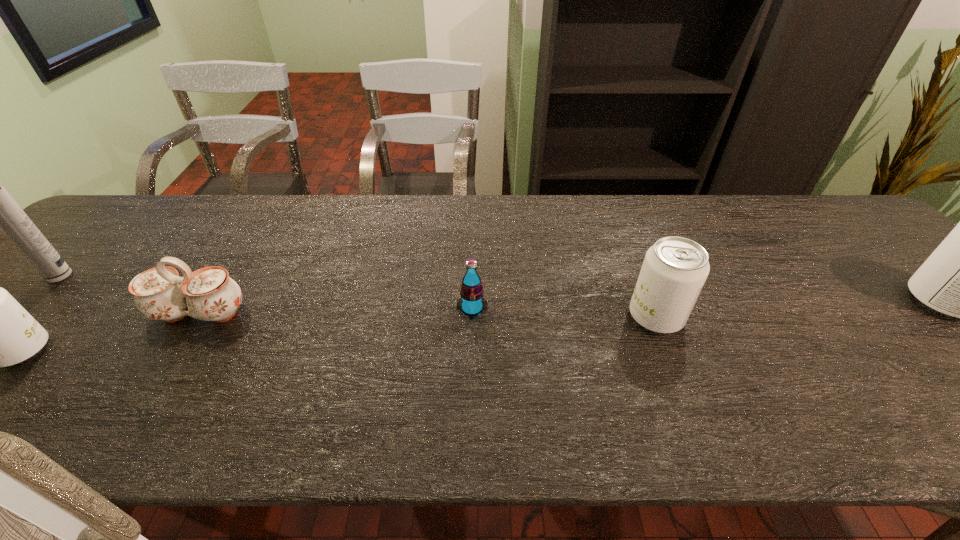
This screenshot has width=960, height=540. Identify the location of object that is the second closest to the rightmost object. (471, 303).

Where is `object that is the fourth closest to the rightmost soda`? object that is the fourth closest to the rightmost soda is located at coordinates (0, 333).

At what (x,y) coordinates should I click in order to perform the action: click on soda object that ranks as the third closest to the second tallest soda. Please return your answer as a coordinate pair (x, y). Looking at the image, I should click on (0, 333).

Where is `soda that stands as the second closest to the third soda from left to right`? The height and width of the screenshot is (540, 960). soda that stands as the second closest to the third soda from left to right is located at coordinates (959, 280).

The image size is (960, 540). I want to click on free location that satisfies the following two spatial constraints: 1. on the front side of the tallest object; 2. on the left side of the third soda from right to left, so click(x=26, y=308).